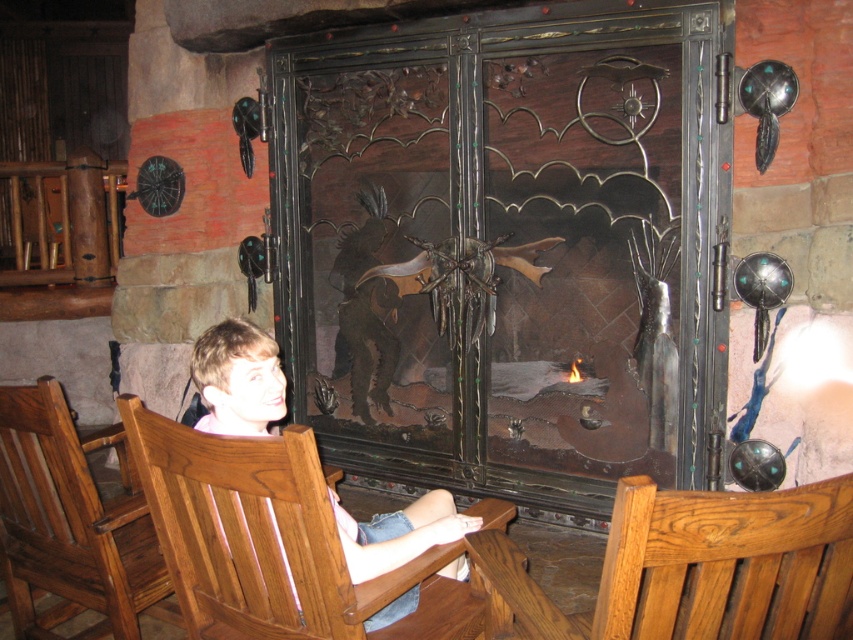
Question: Is brown wood chair at lower left further to camera compared to light brown wood chair at center?

Choices:
 (A) yes
 (B) no

Answer: (A)

Question: Which point is closer to the camera?

Choices:
 (A) (149, 595)
 (B) (444, 492)

Answer: (A)

Question: Does dark wrought iron fireplace at center have a larger size compared to brown wood chair at lower left?

Choices:
 (A) no
 (B) yes

Answer: (B)

Question: Can you confirm if dark wrought iron fireplace at center is positioned to the right of brown wood chair at lower left?

Choices:
 (A) yes
 (B) no

Answer: (A)

Question: Among these objects, which one is nearest to the camera?

Choices:
 (A) dark wrought iron fireplace at center
 (B) light brown wood chair at center

Answer: (B)

Question: Which object is farther from the camera taking this photo?

Choices:
 (A) light brown wood chair at center
 (B) brown wood chair at lower left

Answer: (B)